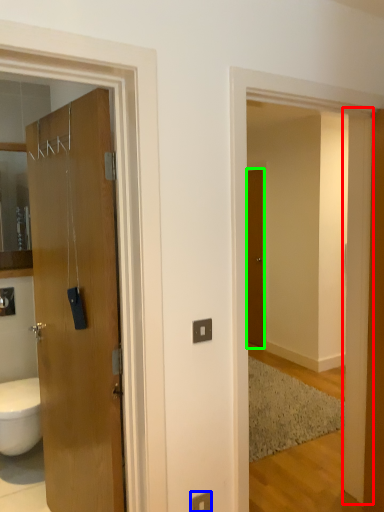
Question: Which object is the farthest from pillar (highlighted by a red box)? Choose among these: electric outlet (highlighted by a blue box) or door (highlighted by a green box).

Choices:
 (A) electric outlet
 (B) door

Answer: (B)